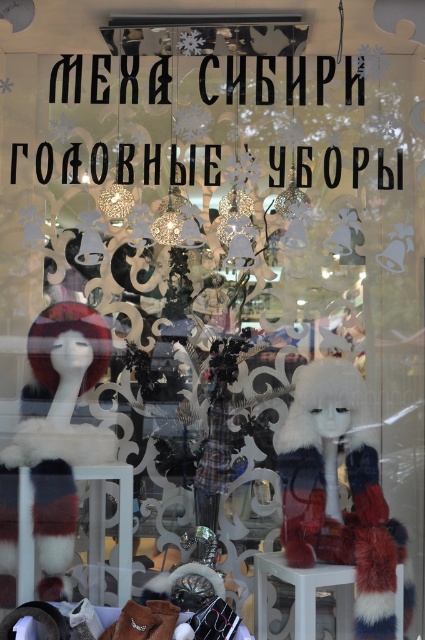
You are a customer looking to buy a hat that can fit on a stool. The store has a white fur hat at center and a white glossy stool at center. Based on their sizes, will the hat fit on the stool?

The white fur hat at center is wider than the white glossy stool at center, so the hat will not fit on the stool.

You are a customer standing in front of the store window. You see the white fur hat at center and the white glossy stool at center. Can you reach the hat without moving the stool?

The white fur hat at center and white glossy stool at center are 5.64 inches apart. Since the distance between them is small, you can likely reach the hat without moving the stool.